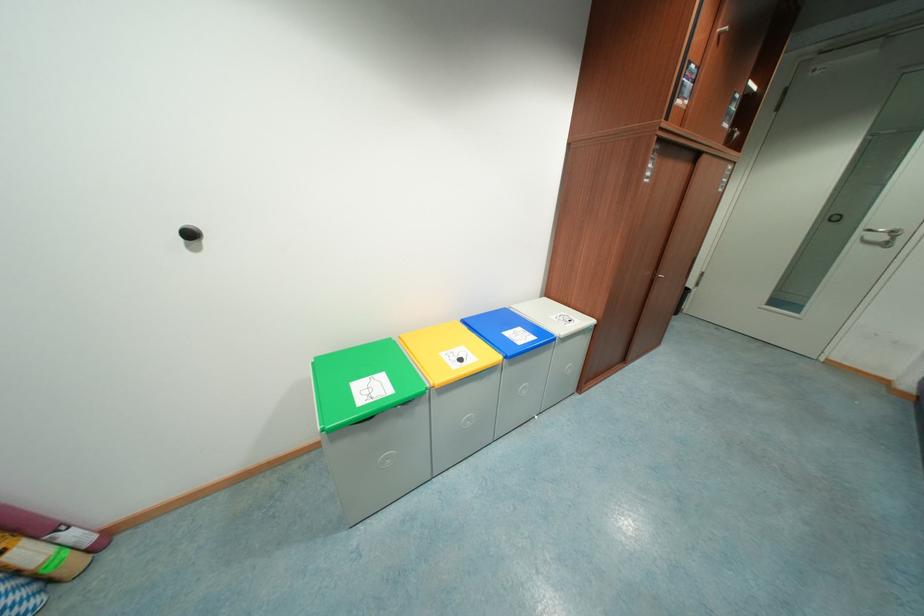
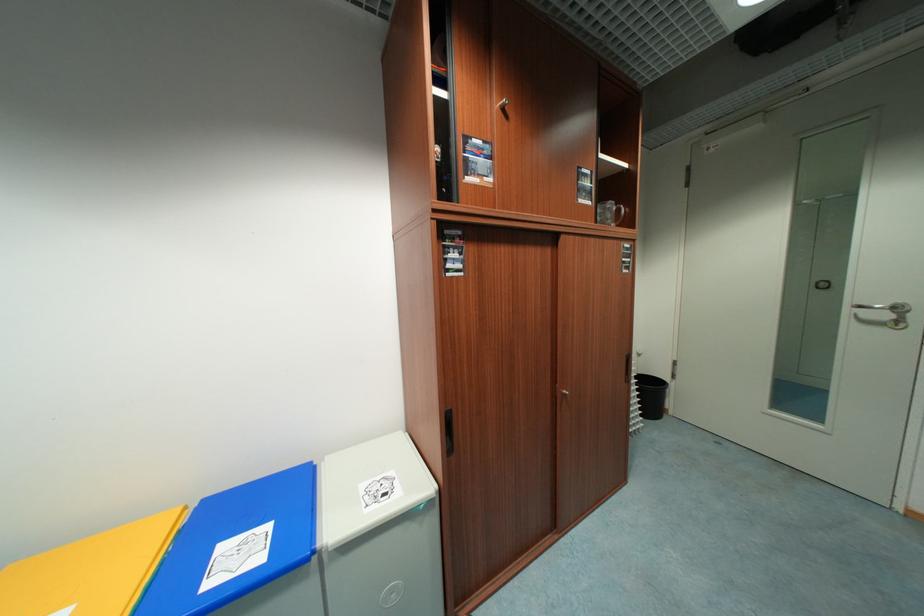
Find the pixel in the second image that matches (526,344) in the first image.

(211, 588)